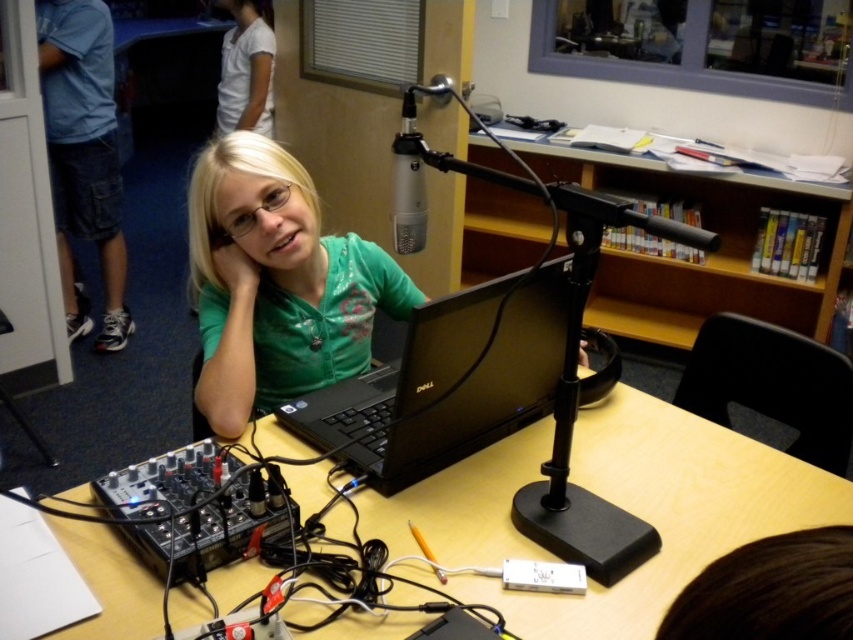
Between wooden bookshelf at upper center and black matte laptop at center, which one appears on the right side from the viewer's perspective?

wooden bookshelf at upper center is more to the right.

Can you confirm if wooden bookshelf at upper center is wider than black matte laptop at center?

Indeed, wooden bookshelf at upper center has a greater width compared to black matte laptop at center.

Is point (485, 236) farther from viewer compared to point (409, 328)?

Yes, it is behind point (409, 328).

Find the location of a particular element. The height and width of the screenshot is (640, 853). wooden bookshelf at upper center is located at coordinates (706, 257).

Is wooden table at center smaller than wooden bookshelf at upper center?

Indeed, wooden table at center has a smaller size compared to wooden bookshelf at upper center.

Does point (506, 547) come in front of point (839, 216)?

Yes, point (506, 547) is closer to viewer.

Does point (548, 612) come farther from viewer compared to point (730, 193)?

No.

Where is `wooden table at center`? The height and width of the screenshot is (640, 853). wooden table at center is located at coordinates (663, 513).

Between green matte shirt at center and white cotton shirt at upper left, which one appears on the right side from the viewer's perspective?

green matte shirt at center is more to the right.

Which is below, green matte shirt at center or white cotton shirt at upper left?

green matte shirt at center

Is point (264, 321) positioned in front of point (259, 4)?

Yes, point (264, 321) is in front of point (259, 4).

Locate an element on the screen. The width and height of the screenshot is (853, 640). green matte shirt at center is located at coordinates (276, 284).